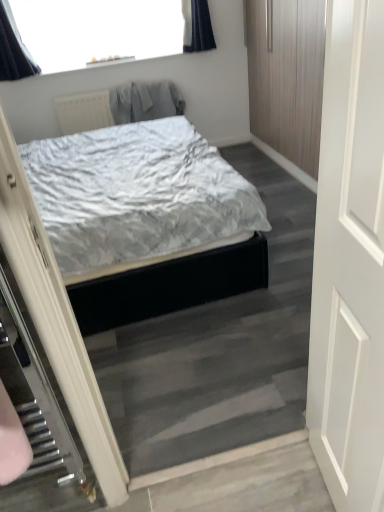
Question: Is white matte door at right in contact with gray fabric robe at upper center?

Choices:
 (A) yes
 (B) no

Answer: (B)

Question: Does white matte door at right lie in front of gray fabric robe at upper center?

Choices:
 (A) yes
 (B) no

Answer: (A)

Question: From the image's perspective, is white matte door at right on gray fabric robe at upper center?

Choices:
 (A) yes
 (B) no

Answer: (B)

Question: Is white matte door at right outside of gray fabric robe at upper center?

Choices:
 (A) yes
 (B) no

Answer: (A)

Question: From a real-world perspective, is white matte door at right located beneath gray fabric robe at upper center?

Choices:
 (A) no
 (B) yes

Answer: (A)

Question: Is white matte door at right positioned with its back to gray fabric robe at upper center?

Choices:
 (A) no
 (B) yes

Answer: (A)

Question: Does gray fabric robe at upper center have a lesser width compared to white matte door at right?

Choices:
 (A) no
 (B) yes

Answer: (A)

Question: From the image's perspective, would you say gray fabric robe at upper center is shown under white matte door at right?

Choices:
 (A) no
 (B) yes

Answer: (A)

Question: Considering the relative positions of gray fabric robe at upper center and white matte door at right in the image provided, is gray fabric robe at upper center behind white matte door at right?

Choices:
 (A) no
 (B) yes

Answer: (B)

Question: Considering the relative positions of gray fabric robe at upper center and white matte door at right in the image provided, is gray fabric robe at upper center to the left of white matte door at right from the viewer's perspective?

Choices:
 (A) yes
 (B) no

Answer: (A)

Question: From the image's perspective, would you say gray fabric robe at upper center is positioned over white matte door at right?

Choices:
 (A) no
 (B) yes

Answer: (B)

Question: Does gray fabric robe at upper center turn towards white matte door at right?

Choices:
 (A) yes
 (B) no

Answer: (A)

Question: Would you say white matte door at right is to the left or to the right of gray fabric robe at upper center in the picture?

Choices:
 (A) right
 (B) left

Answer: (A)